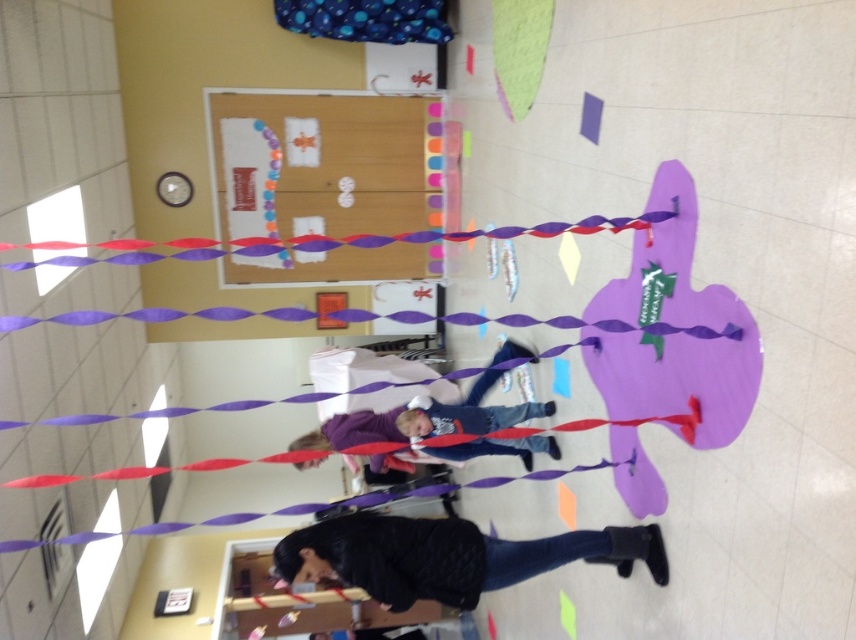
You are standing in the classroom and want to hang a small poster on the matte cardboard bulletin board at upper center. The point you are aiming for is at coordinates point (324, 163). Is this point on the bulletin board?

Yes, the point (324, 163) is on the matte cardboard bulletin board at upper center, so you can hang your poster there.

You are organizing a school event and need to hang a large poster. You have two options for placement on the wall. One is near the matte cardboard bulletin board at upper center and the other is near the black textured jacket at lower center. Which location has more space available for the poster?

The matte cardboard bulletin board at upper center is bigger than the black textured jacket at lower center, so there is more space available near the matte cardboard bulletin board at upper center for the poster.